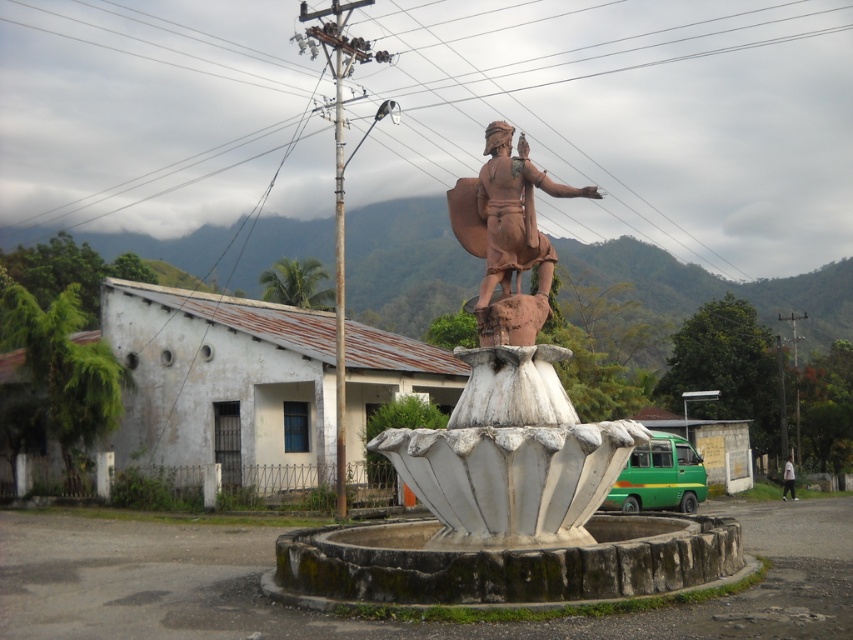
You are standing in front of the statue and want to place a flower bouquet exactly at the point marked as point (x=563, y=534). If your arm reaches 1.5 meters, can you reach that point without moving closer?

The point (x=563, y=534) is 11.70 meters away from the viewer. Since your arm only reaches 1.5 meters, you cannot reach the point without moving closer.

You are a tourist standing in front of the brown clay statue at center and the white fabric person at lower right. Which object is nearer to you?

The brown clay statue at center is closer to the viewer than the white fabric person at lower right, so the brown clay statue at center is nearer to you.

You are a tour guide leading a group to the brown clay statue at center. A tourist asks if they can walk directly from their current position at the white fabric person at lower right to the statue. Considering the straight line distance, is this possible without any obstacles?

The straight line distance between the brown clay statue at center and the white fabric person at lower right is 29.12 meters. Assuming there are no obstacles in between, the tourist can walk directly to the statue.